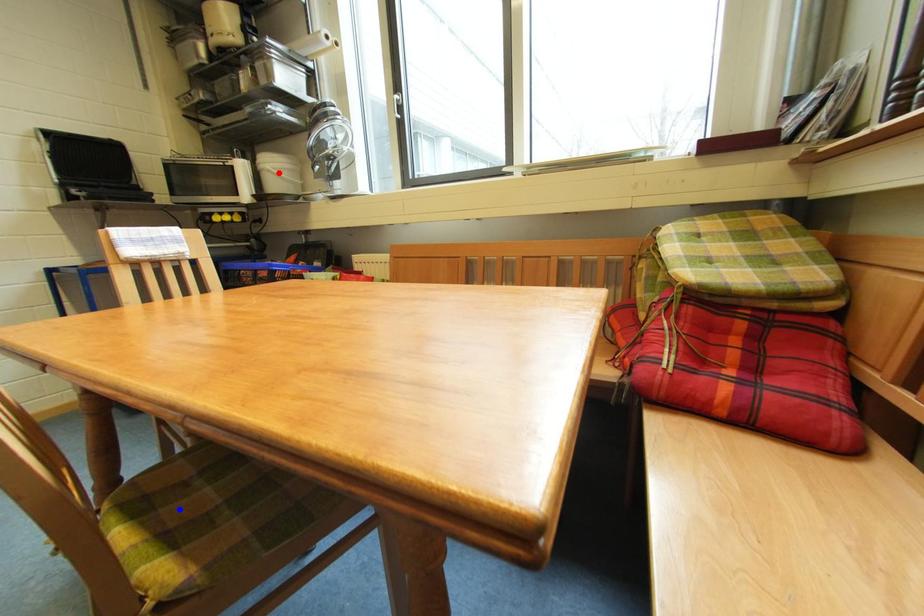
Question: Two points are marked on the image. Which point is closer to the camera?

Choices:
 (A) Blue point is closer.
 (B) Red point is closer.

Answer: (A)